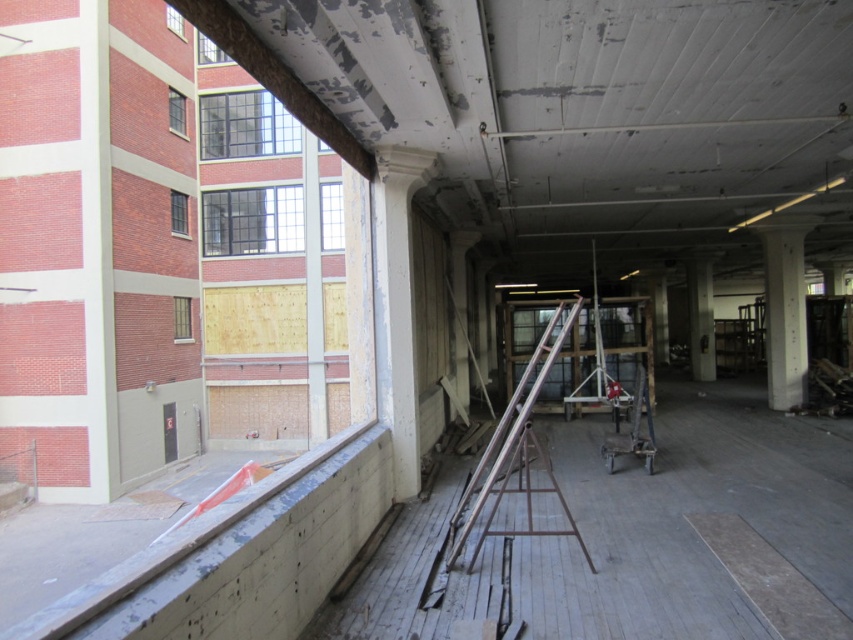
Who is more distant from viewer, [399,156] or [788,404]?

The point [788,404] is behind.

Is white concrete column at center taller than white smooth column at right?

No.

Between point (405, 278) and point (793, 273), which one is positioned behind?

Point (793, 273)

The width and height of the screenshot is (853, 640). Find the location of `white concrete column at center`. white concrete column at center is located at coordinates (396, 307).

Does white concrete column at center appear under metallic silver ladder at center?

Incorrect, white concrete column at center is not positioned below metallic silver ladder at center.

Is point (398, 177) in front of point (502, 486)?

No, (398, 177) is behind (502, 486).

Who is more forward, (434, 160) or (498, 426)?

Point (434, 160) is in front.

Locate an element on the screen. white concrete column at center is located at coordinates point(396,307).

Can you confirm if white concrete column at center is bigger than white glossy pillar at center?

Incorrect, white concrete column at center is not larger than white glossy pillar at center.

Between white concrete column at center and white glossy pillar at center, which one is positioned lower?

Positioned lower is white concrete column at center.

The height and width of the screenshot is (640, 853). Identify the location of white concrete column at center. (396, 307).